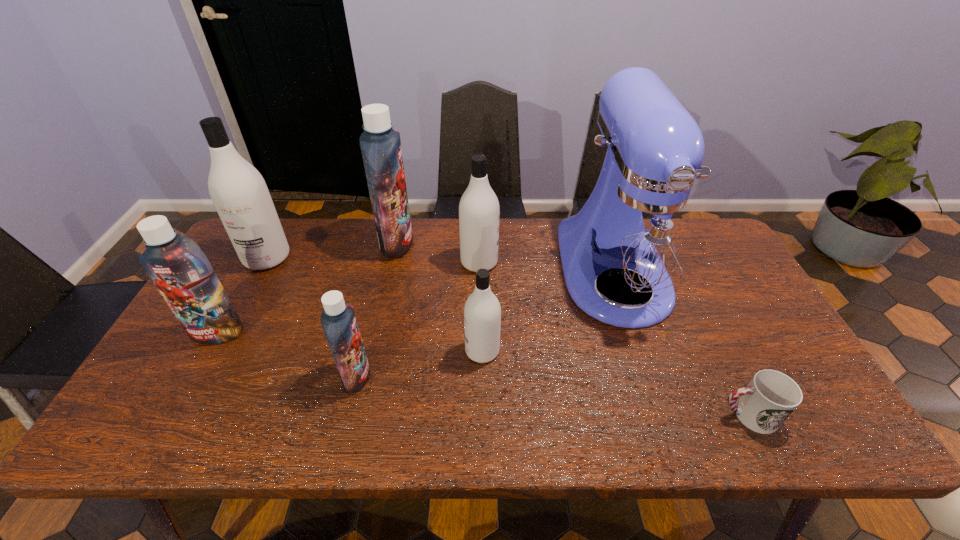
Image resolution: width=960 pixels, height=540 pixels. I want to click on the shortest object, so 771,396.

Where is `free space located at the mixing area of the blue mixer`? free space located at the mixing area of the blue mixer is located at coordinates (652, 388).

I want to click on free space located 0.380m on the front label of the farthest blue shampoo, so [528, 243].

This screenshot has width=960, height=540. In order to click on free space located 0.170m on the front-facing side of the biggest white shampoo in this screenshot , I will do `click(236, 315)`.

The height and width of the screenshot is (540, 960). I want to click on vacant region located on the front-facing side of the second smallest white shampoo, so click(565, 262).

Identify the location of free region located on the front label of the second nearest blue shampoo. This screenshot has width=960, height=540. (196, 372).

This screenshot has width=960, height=540. I want to click on vacant space located on the front label of the smallest blue shampoo, so click(419, 375).

What are the coordinates of `free region located 0.360m on the front-facing side of the smallest white shampoo` in the screenshot? It's located at (324, 351).

Locate an element on the screen. vacant space located 0.340m on the front-facing side of the smallest white shampoo is located at coordinates (332, 351).

Identify the location of vacant space positioned on the front-facing side of the smallest white shampoo. This screenshot has height=540, width=960. (375, 351).